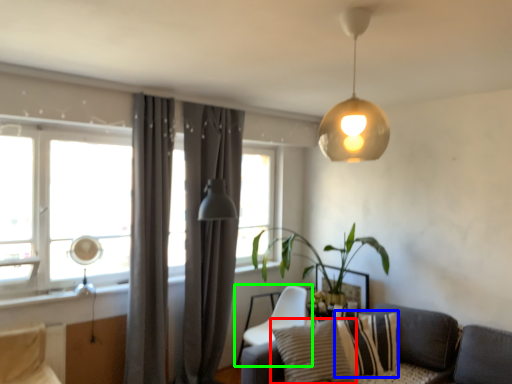
Question: Which object is the closest to the pillow (highlighted by a red box)? Choose among these: pillow (highlighted by a blue box) or chair (highlighted by a green box).

Choices:
 (A) pillow
 (B) chair

Answer: (A)